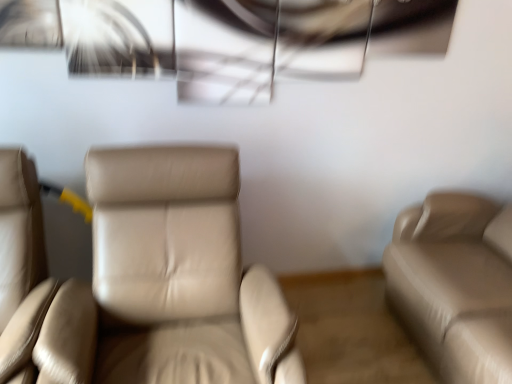
Question: Is beige leather couch at right surrounding beige leather chair at center, arranged as the 2th chair when viewed from the left?

Choices:
 (A) no
 (B) yes

Answer: (A)

Question: Is beige leather couch at right smaller than beige leather chair at center, marked as the 1th chair in a right-to-left arrangement?

Choices:
 (A) no
 (B) yes

Answer: (A)

Question: From a real-world perspective, is beige leather couch at right beneath beige leather chair at center, arranged as the 2th chair when viewed from the left?

Choices:
 (A) no
 (B) yes

Answer: (A)

Question: Is beige leather couch at right not within beige leather chair at center, arranged as the 2th chair when viewed from the left?

Choices:
 (A) yes
 (B) no

Answer: (A)

Question: Can you confirm if beige leather couch at right is positioned to the right of beige leather chair at center, arranged as the 2th chair when viewed from the left?

Choices:
 (A) yes
 (B) no

Answer: (A)

Question: Considering the positions of beige leather chair at left, acting as the second chair starting from the right, and beige leather chair at center, marked as the 1th chair in a right-to-left arrangement, in the image, is beige leather chair at left, acting as the second chair starting from the right, bigger or smaller than beige leather chair at center, marked as the 1th chair in a right-to-left arrangement,?

Choices:
 (A) small
 (B) big

Answer: (A)

Question: Is point (89, 380) positioned closer to the camera than point (216, 269)?

Choices:
 (A) closer
 (B) farther

Answer: (A)

Question: Looking at their shapes, would you say beige leather chair at left, which is the 1th chair from left to right, is wider or thinner than beige leather chair at center, marked as the 1th chair in a right-to-left arrangement?

Choices:
 (A) thin
 (B) wide

Answer: (A)

Question: From a real-world perspective, is beige leather chair at left, which is the 1th chair from left to right, positioned above or below beige leather chair at center, arranged as the 2th chair when viewed from the left?

Choices:
 (A) above
 (B) below

Answer: (A)

Question: Considering the positions of point (457, 349) and point (15, 203), is point (457, 349) closer or farther from the camera than point (15, 203)?

Choices:
 (A) closer
 (B) farther

Answer: (B)

Question: From a real-world perspective, is beige leather couch at right above or below beige leather chair at left, acting as the second chair starting from the right?

Choices:
 (A) below
 (B) above

Answer: (B)

Question: Considering the positions of beige leather couch at right and beige leather chair at left, acting as the second chair starting from the right, in the image, is beige leather couch at right wider or thinner than beige leather chair at left, acting as the second chair starting from the right,?

Choices:
 (A) thin
 (B) wide

Answer: (B)

Question: Is beige leather couch at right situated inside beige leather chair at left, which is the 1th chair from left to right, or outside?

Choices:
 (A) outside
 (B) inside

Answer: (A)

Question: Is beige leather chair at center, marked as the 1th chair in a right-to-left arrangement, in front of or behind beige leather chair at left, which is the 1th chair from left to right, in the image?

Choices:
 (A) behind
 (B) front

Answer: (B)

Question: From a real-world perspective, relative to beige leather chair at left, acting as the second chair starting from the right, is beige leather chair at center, marked as the 1th chair in a right-to-left arrangement, vertically above or below?

Choices:
 (A) above
 (B) below

Answer: (B)